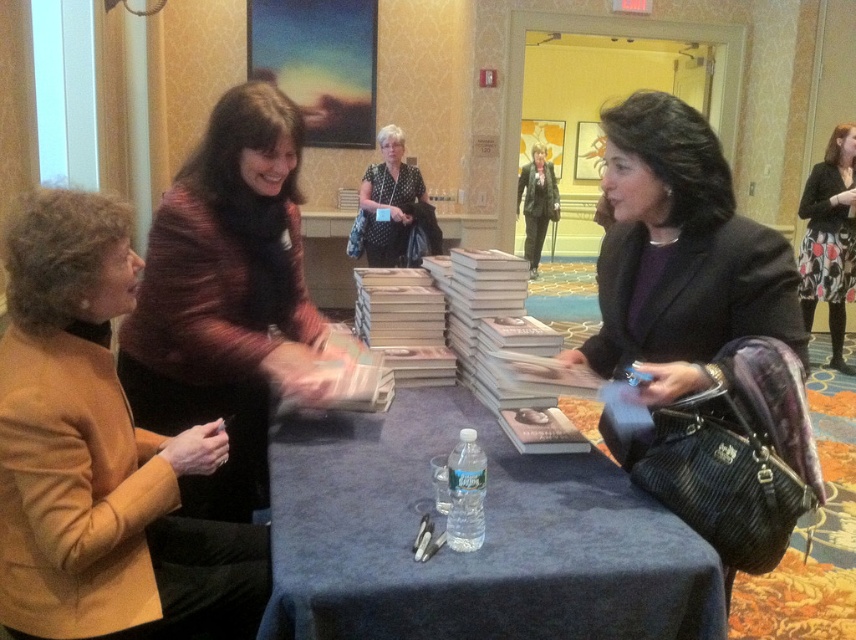
Between point (510, 612) and point (357, 234), which one is positioned in front?

Point (510, 612)

Is blue fabric table at center taller than polka dot blouse at center?

No, blue fabric table at center is not taller than polka dot blouse at center.

Is point (367, 522) positioned behind point (373, 225)?

That is False.

This screenshot has width=856, height=640. Find the location of `blue fabric table at center`. blue fabric table at center is located at coordinates (483, 541).

Does blue fabric table at center have a greater width compared to matte gold jacket at left?

Indeed, blue fabric table at center has a greater width compared to matte gold jacket at left.

Between point (403, 442) and point (189, 595), which one is positioned behind?

Positioned behind is point (403, 442).

This screenshot has width=856, height=640. I want to click on blue fabric table at center, so click(x=483, y=541).

Between blue fabric table at center and striped wool sweater at center, which one appears on the left side from the viewer's perspective?

From the viewer's perspective, striped wool sweater at center appears more on the left side.

Is point (550, 636) positioned before point (275, 170)?

Yes, it is.

The image size is (856, 640). In order to click on blue fabric table at center in this screenshot , I will do `click(483, 541)`.